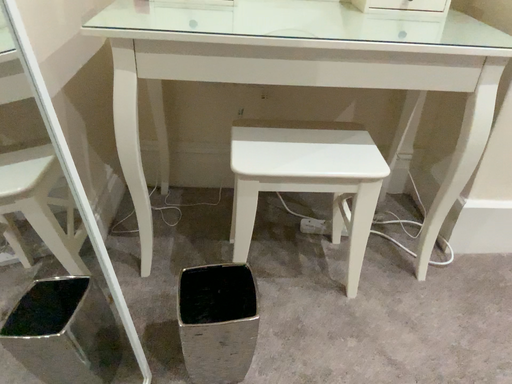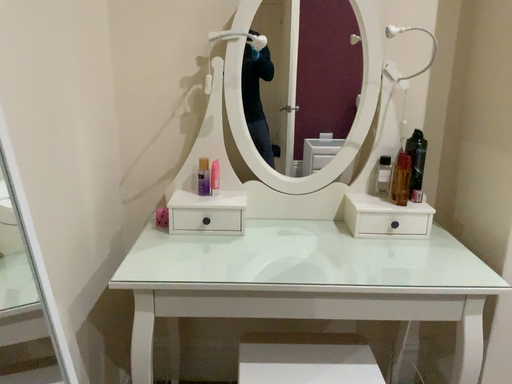
Question: How did the camera likely rotate when shooting the video?

Choices:
 (A) rotated downward
 (B) rotated upward

Answer: (B)